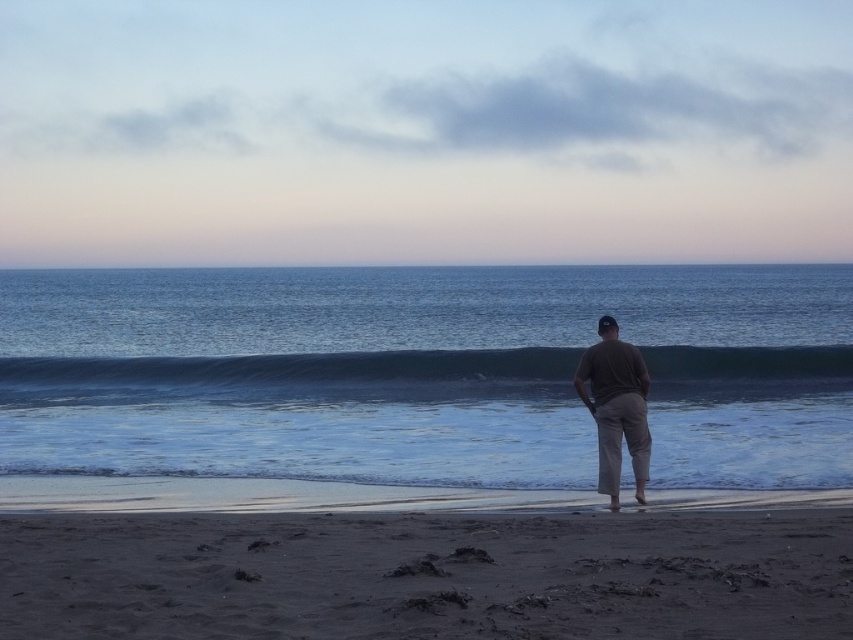
Question: Is blue glossy wave at center behind brown cotton shirt at center?

Choices:
 (A) no
 (B) yes

Answer: (B)

Question: Which of the following is the farthest from the observer?

Choices:
 (A) (247, 364)
 (B) (189, 529)
 (C) (643, 413)

Answer: (A)

Question: Based on their relative distances, which object is farther from the dark sand at lower center?

Choices:
 (A) blue glossy wave at center
 (B) blue water at center

Answer: (B)

Question: Is dark sand at lower center above blue glossy wave at center?

Choices:
 (A) yes
 (B) no

Answer: (B)

Question: Is dark sand at lower center positioned at the back of brown cotton shirt at center?

Choices:
 (A) no
 (B) yes

Answer: (A)

Question: Which object is farther from the camera taking this photo?

Choices:
 (A) blue water at center
 (B) blue glossy wave at center
 (C) dark sand at lower center
 (D) brown cotton shirt at center

Answer: (A)